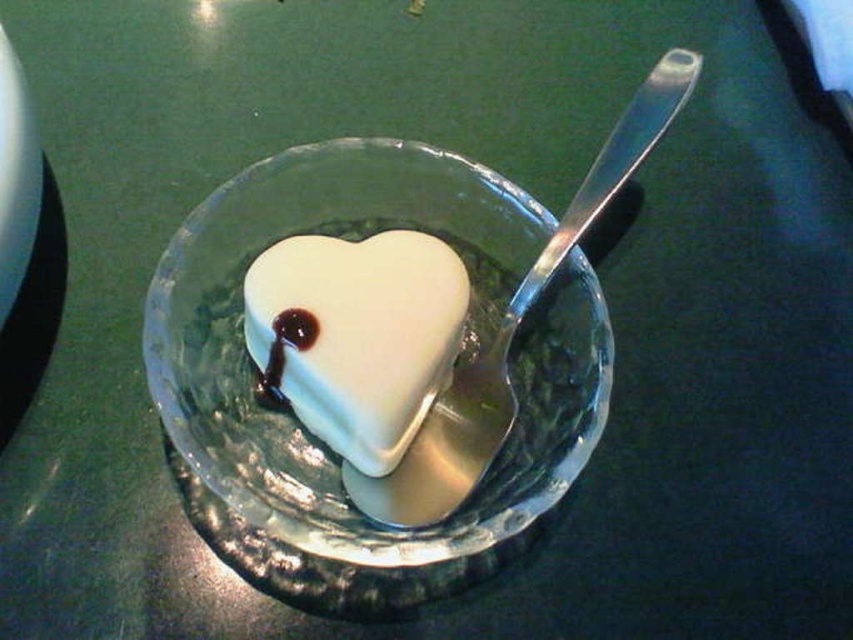
Question: Considering the real-world distances, which object is closest to the white glossy heart at center?

Choices:
 (A) satin silver spoon at upper right
 (B) transparent glass bowl at center

Answer: (B)

Question: Is transparent glass bowl at center thinner than satin silver spoon at upper right?

Choices:
 (A) no
 (B) yes

Answer: (A)

Question: Which point is farther from the camera taking this photo?

Choices:
 (A) click(x=407, y=422)
 (B) click(x=338, y=580)

Answer: (A)

Question: Can you confirm if white glossy heart at center is bigger than satin silver spoon at upper right?

Choices:
 (A) no
 (B) yes

Answer: (A)

Question: Which of the following is the farthest from the observer?

Choices:
 (A) transparent glass bowl at center
 (B) white glossy heart at center

Answer: (B)

Question: From the image, what is the correct spatial relationship of white glossy heart at center in relation to satin silver spoon at upper right?

Choices:
 (A) above
 (B) below

Answer: (B)